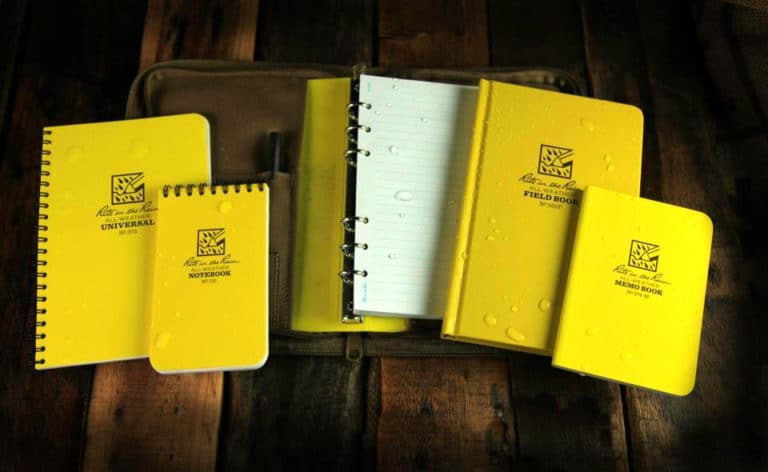
Locate an element on the screen. memo book is located at coordinates (634, 283).